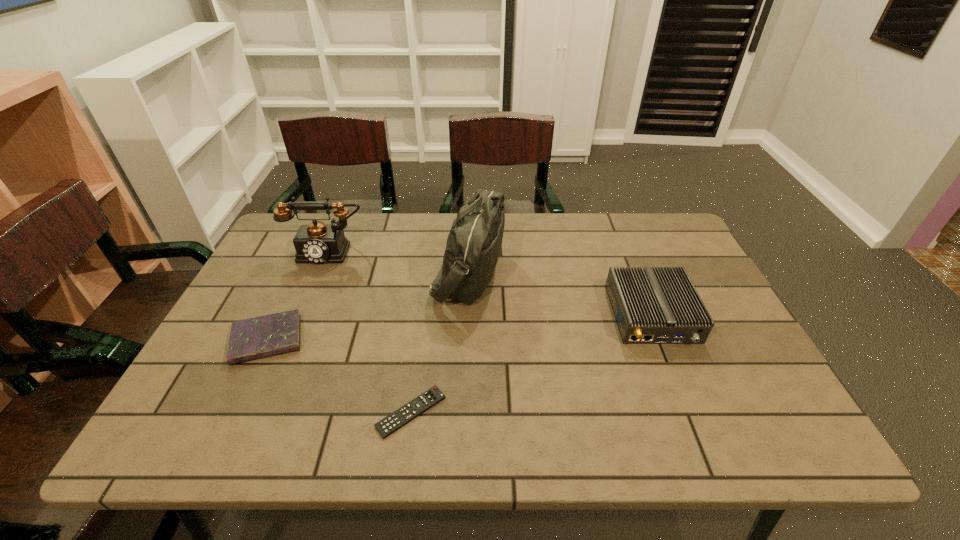
This screenshot has width=960, height=540. I want to click on unoccupied area between the tallest object and the second shortest object, so click(368, 306).

Where is `free point between the telephone and the second shortest object`? This screenshot has width=960, height=540. free point between the telephone and the second shortest object is located at coordinates (298, 295).

This screenshot has width=960, height=540. Identify the location of unoccupied area between the remote control and the telephone. (370, 331).

Where is `empty location between the nearest object and the fourth shortest object`? The image size is (960, 540). empty location between the nearest object and the fourth shortest object is located at coordinates (370, 331).

This screenshot has height=540, width=960. What are the coordinates of `vacant space in between the second shortest object and the telephone` in the screenshot? It's located at (298, 295).

The image size is (960, 540). Find the location of `object that stands as the fourth closest to the third tallest object`. object that stands as the fourth closest to the third tallest object is located at coordinates click(255, 338).

This screenshot has width=960, height=540. I want to click on the closest object to the second shortest object, so click(x=317, y=243).

Identify the location of free space that satisfies the following two spatial constraints: 1. on the front side of the nearest object; 2. on the left side of the diary. (232, 412).

What are the coordinates of `free location that satisfies the following two spatial constraints: 1. on the front of the nearest object at the rotary dial; 2. on the right side of the telephone` in the screenshot? It's located at (258, 412).

Locate an element on the screen. The image size is (960, 540). vacant region that satisfies the following two spatial constraints: 1. at the front padded panel of the shoulder bag; 2. on the front side of the fourth tallest object is located at coordinates (467, 340).